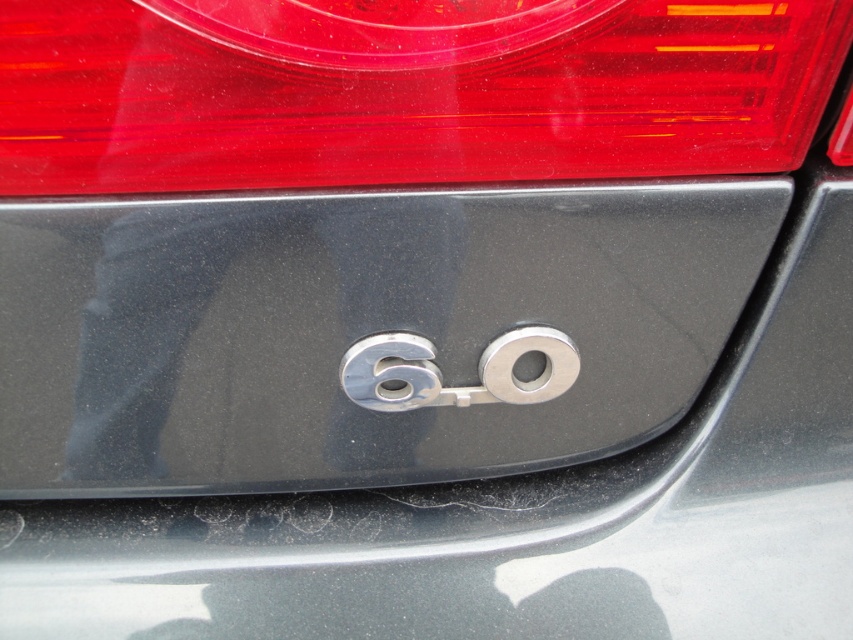
Question: Which point is farther from the camera taking this photo?

Choices:
 (A) (376, 336)
 (B) (735, 54)
 (C) (300, 282)

Answer: (A)

Question: Does transparent plastic brake light at upper center have a greater width compared to chrome metallic number at center?

Choices:
 (A) no
 (B) yes

Answer: (B)

Question: Is transparent plastic brake light at upper center below chrome metallic number at center?

Choices:
 (A) no
 (B) yes

Answer: (A)

Question: Estimate the real-world distances between objects in this image. Which object is farther from the metallic gray emblem at center?

Choices:
 (A) transparent plastic brake light at upper center
 (B) chrome metallic number at center

Answer: (A)

Question: Which of the following is the closest to the observer?

Choices:
 (A) (100, 124)
 (B) (409, 380)
 (C) (471, 424)

Answer: (A)

Question: Does metallic gray emblem at center appear on the left side of chrome metallic number at center?

Choices:
 (A) no
 (B) yes

Answer: (B)